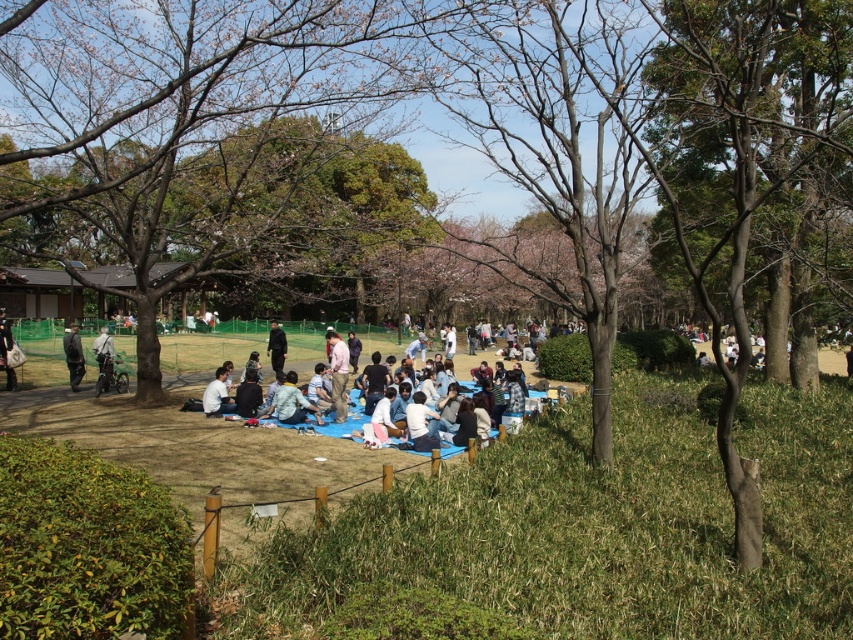
Which is more to the left, brown bark tree at center or green bark tree at center?

Positioned to the left is brown bark tree at center.

Measure the distance between brown bark tree at center and green bark tree at center.

33.16 feet

Who is more distant from viewer, [160,150] or [779,12]?

The point [779,12] is behind.

What are the coordinates of `brown bark tree at center` in the screenshot? It's located at (183, 108).

Find the location of a particular element. This screenshot has height=640, width=853. green bark tree at center is located at coordinates (738, 160).

Between green bark tree at center and light blue denim jacket at center, which one appears on the left side from the viewer's perspective?

Positioned to the left is light blue denim jacket at center.

Measure the distance between point [782,97] and camera.

22.44 meters

The height and width of the screenshot is (640, 853). In order to click on green bark tree at center in this screenshot , I will do coord(738,160).

This screenshot has width=853, height=640. What do you see at coordinates (292, 403) in the screenshot? I see `light blue denim jacket at center` at bounding box center [292, 403].

Between light blue denim jacket at center and light gray fabric bag at center, which one has more height?

With more height is light gray fabric bag at center.

You are a GUI agent. You are given a task and a screenshot of the screen. Output one action in this format:
    pyautogui.click(x=<x>, y=<y>)
    Task: Click on the light blue denim jacket at center
    The height and width of the screenshot is (640, 853).
    Given the screenshot: What is the action you would take?
    click(x=292, y=403)